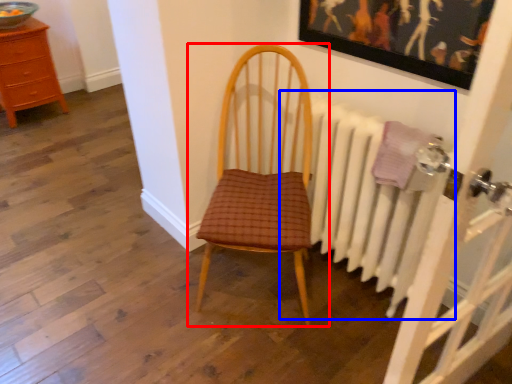
Question: Which object appears closest to the camera in this image, chair (highlighted by a red box) or radiator (highlighted by a blue box)?

Choices:
 (A) chair
 (B) radiator

Answer: (A)